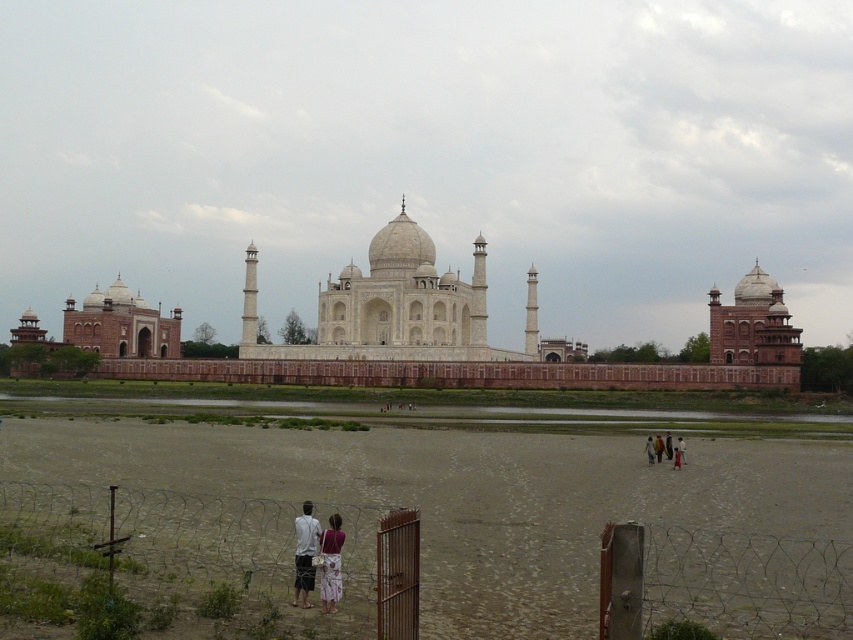
You are a tourist visiting the Taj Mahal and notice the white marble palace at center and the matte white dress at center. Which object is positioned higher in the scene?

The white marble palace at center is positioned higher than the matte white dress at center.

You are a tourist visiting the Taj Mahal and you see two dresses in the foreground, a matte white dress at center and a white cotton dress at center. Which dress is nearer to you?

The matte white dress at center is closer to the viewer than the white cotton dress at center, so the matte white dress at center is nearer.